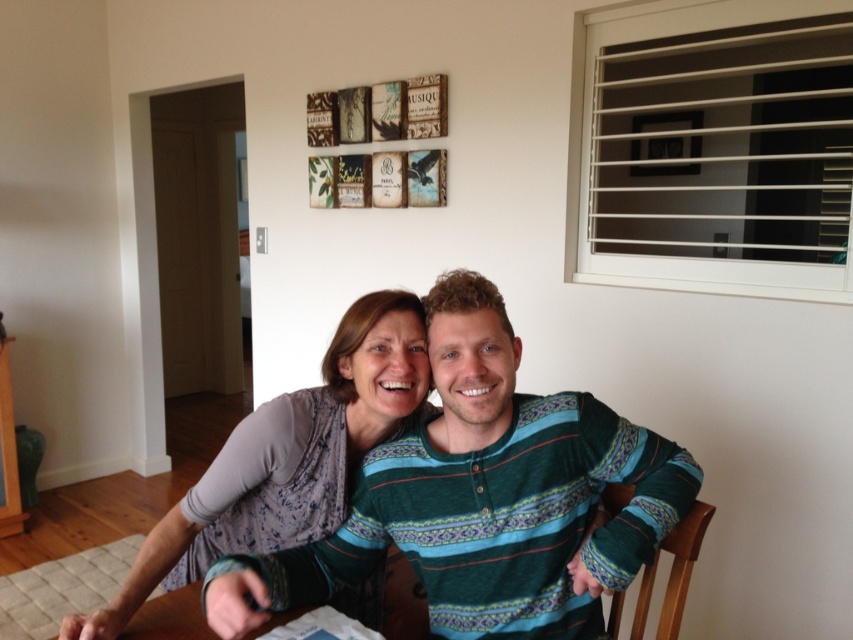
Which of these two, striped cotton shirt at center or matte gray shirt at center, stands taller?

With more height is matte gray shirt at center.

Measure the distance from striped cotton shirt at center to matte gray shirt at center.

striped cotton shirt at center is 8.74 inches away from matte gray shirt at center.

Where is `striped cotton shirt at center`? This screenshot has height=640, width=853. striped cotton shirt at center is located at coordinates pyautogui.click(x=485, y=499).

Locate an element on the screen. striped cotton shirt at center is located at coordinates (485, 499).